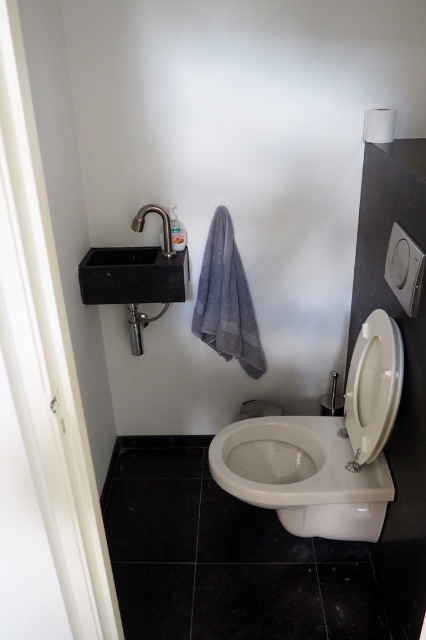
Question: Which point is farther to the camera?

Choices:
 (A) (357, 342)
 (B) (253, 502)
 (C) (394, 109)

Answer: (A)

Question: Does white plastic toilet lid at lower right appear on the right side of black granite sink at left?

Choices:
 (A) no
 (B) yes

Answer: (B)

Question: Among these objects, which one is nearest to the camera?

Choices:
 (A) gray matte towel bar at upper center
 (B) white plastic toilet lid at lower right
 (C) white glossy toilet at center

Answer: (B)

Question: Can you confirm if white plastic toilet lid at lower right is bigger than gray matte towel bar at upper center?

Choices:
 (A) no
 (B) yes

Answer: (B)

Question: Which point is farther to the camera?

Choices:
 (A) white glossy toilet at center
 (B) white plastic toilet lid at lower right

Answer: (A)

Question: Considering the relative positions of white plastic toilet lid at lower right and gray matte towel bar at upper center in the image provided, where is white plastic toilet lid at lower right located with respect to gray matte towel bar at upper center?

Choices:
 (A) right
 (B) left

Answer: (B)